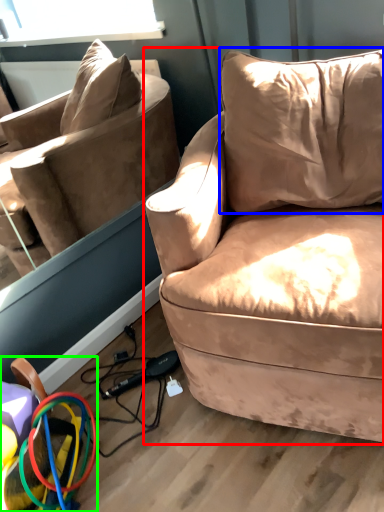
Question: Considering the real-world distances, which object is farthest from studio couch (highlighted by a red box)? pillow (highlighted by a blue box) or toy (highlighted by a green box)?

Choices:
 (A) pillow
 (B) toy

Answer: (B)